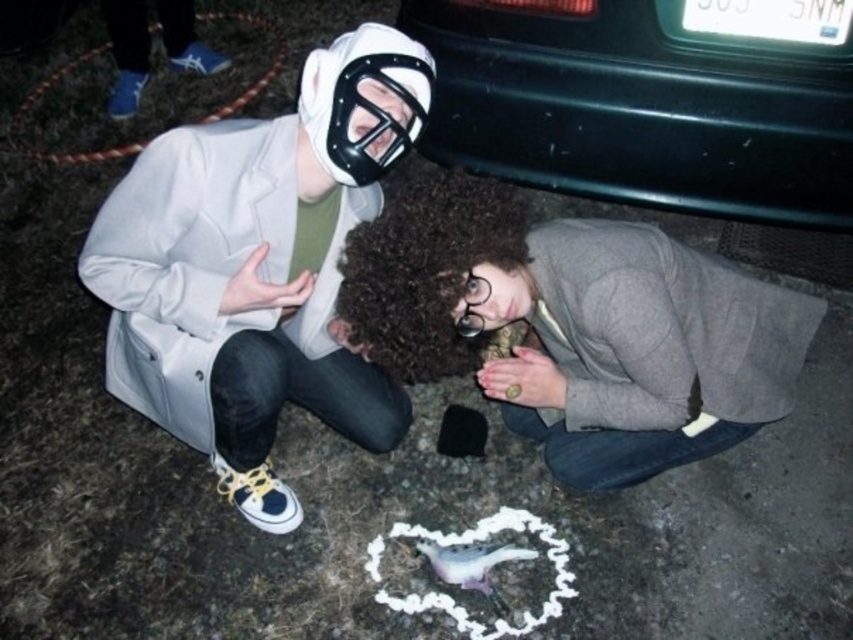
Question: Can you confirm if gray wool sweater at lower center is bigger than black plastic car at upper right?

Choices:
 (A) no
 (B) yes

Answer: (B)

Question: Is the position of white matte mask at upper left more distant than that of gray wool sweater at lower center?

Choices:
 (A) yes
 (B) no

Answer: (A)

Question: Can you confirm if white matte mask at upper left is positioned below black plastic car at upper right?

Choices:
 (A) yes
 (B) no

Answer: (A)

Question: Which object is farther from the camera taking this photo?

Choices:
 (A) black plastic car at upper right
 (B) gray wool sweater at lower center
 (C) white matte mask at upper left

Answer: (A)

Question: Which object is the closest to the black plastic car at upper right?

Choices:
 (A) white matte mask at upper left
 (B) gray wool sweater at lower center

Answer: (B)

Question: Among these points, which one is nearest to the camera?

Choices:
 (A) click(x=366, y=209)
 (B) click(x=662, y=346)
 (C) click(x=759, y=218)

Answer: (B)